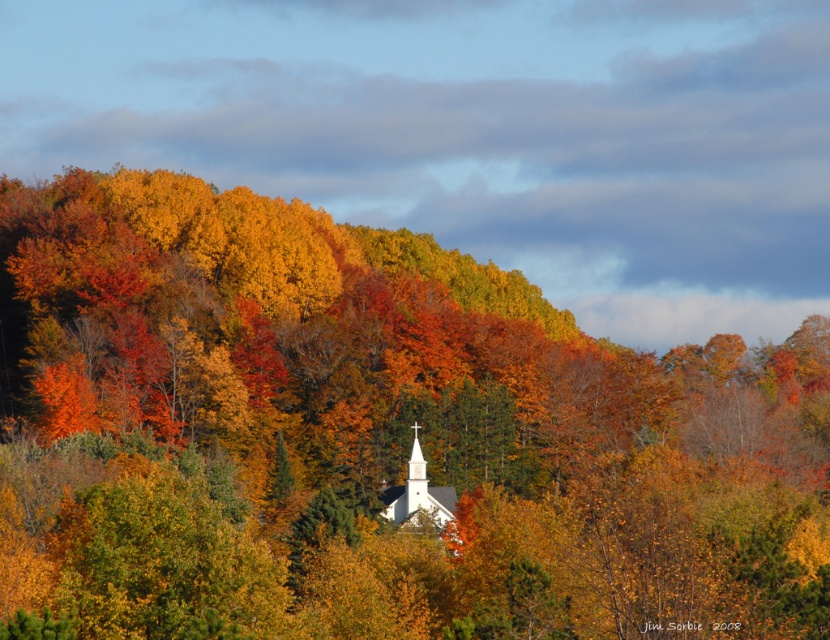
You are an architect designing a new garden layout around the white smooth chapel at center. You notice the matte orange tree at center nearby. Considering their relative heights, which object would cast a longer shadow during midday when the sun is directly overhead?

The matte orange tree at center is taller than the white smooth chapel at center, so it would cast a longer shadow during midday when the sun is directly overhead.

You are standing in the autumn forest looking at the scene. There is a matte orange tree at center and a white smooth chapel at center. Which object is positioned to the right side?

The matte orange tree at center is positioned to the right of the white smooth chapel at center.